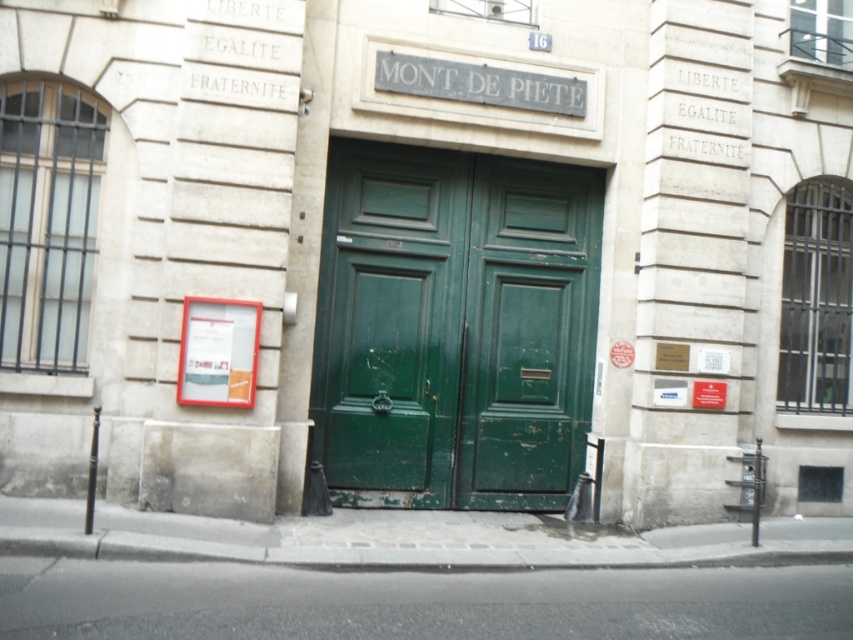
You are a delivery person trying to enter the building. You have a large cart that requires a doorway at least 1 meter wide. The green matte door at center and the green wood door at center are both potential entry points. Based on their sizes, which door should you choose?

The green matte door at center has a larger width than the green wood door at center, so you should choose the green matte door at center since it can accommodate your large cart requiring at least 1 meter width.

You are standing in front of the building entrance and notice two points marked on the wall. The first point is at coordinates point (436, 314) and the second is at point (508, 310). Which point is closer to you?

Point point (436, 314) is in front of point point (508, 310), so it is closer to you.

You are a delivery person trying to enter the building through the entrance. You see two doors, the green matte door at center and the green wood door at center. Which door is bigger?

The green matte door at center is larger in size compared to the green wood door at center.